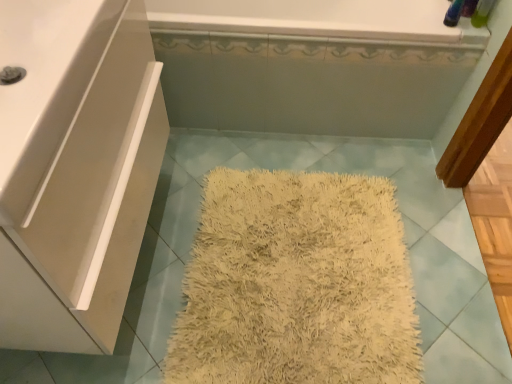
Question: Does white glossy sink at left have a larger size compared to white glossy bathtub at upper center?

Choices:
 (A) yes
 (B) no

Answer: (B)

Question: Considering the relative sizes of white glossy sink at left and white glossy bathtub at upper center in the image provided, is white glossy sink at left smaller than white glossy bathtub at upper center?

Choices:
 (A) yes
 (B) no

Answer: (A)

Question: Considering the relative sizes of white glossy sink at left and white glossy bathtub at upper center in the image provided, is white glossy sink at left wider than white glossy bathtub at upper center?

Choices:
 (A) yes
 (B) no

Answer: (B)

Question: Can you confirm if white glossy sink at left is taller than white glossy bathtub at upper center?

Choices:
 (A) yes
 (B) no

Answer: (B)

Question: Can you confirm if white glossy sink at left is positioned to the left of white glossy bathtub at upper center?

Choices:
 (A) yes
 (B) no

Answer: (A)

Question: Is white glossy sink at left with white glossy bathtub at upper center?

Choices:
 (A) yes
 (B) no

Answer: (B)

Question: Can we say white glossy sink at left lies outside white glossy cabinet at left?

Choices:
 (A) yes
 (B) no

Answer: (B)

Question: Does white glossy sink at left come behind white glossy cabinet at left?

Choices:
 (A) no
 (B) yes

Answer: (A)

Question: Can you confirm if white glossy sink at left is shorter than white glossy cabinet at left?

Choices:
 (A) no
 (B) yes

Answer: (B)

Question: Is white glossy sink at left in contact with white glossy cabinet at left?

Choices:
 (A) no
 (B) yes

Answer: (A)

Question: Is white glossy sink at left taller than white glossy cabinet at left?

Choices:
 (A) no
 (B) yes

Answer: (A)

Question: Would you say white glossy sink at left is a long distance from white glossy cabinet at left?

Choices:
 (A) no
 (B) yes

Answer: (A)

Question: From a real-world perspective, does white glossy cabinet at left sit lower than white glossy sink at left?

Choices:
 (A) yes
 (B) no

Answer: (A)